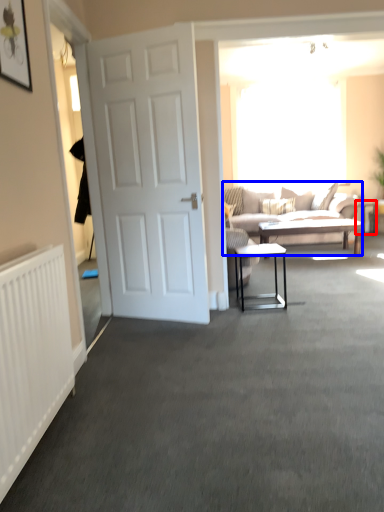
Question: Among these objects, which one is nearest to the camera, side table (highlighted by a red box) or studio couch (highlighted by a blue box)?

Choices:
 (A) side table
 (B) studio couch

Answer: (B)